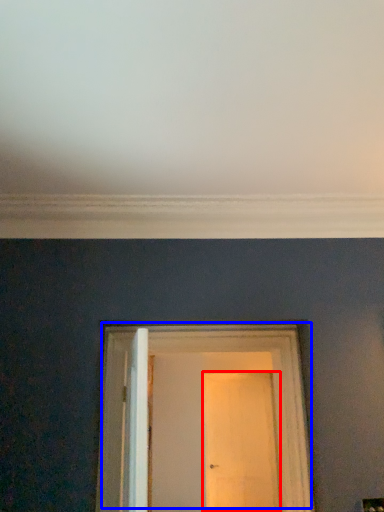
Question: Which object is closer to the camera taking this photo, door (highlighted by a red box) or door (highlighted by a blue box)?

Choices:
 (A) door
 (B) door

Answer: (B)